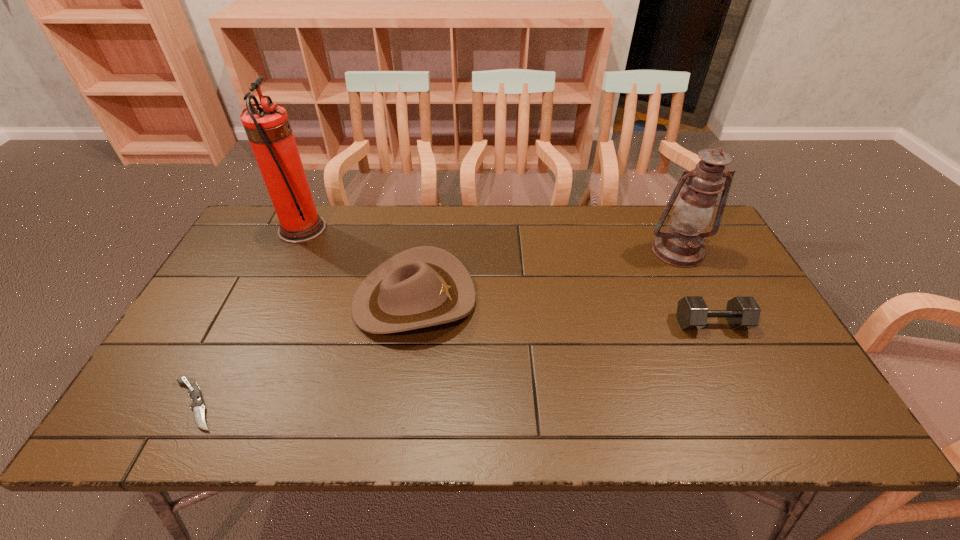
Find the location of a particular element. object that is at the near left corner is located at coordinates (197, 405).

The height and width of the screenshot is (540, 960). In order to click on object located in the far right corner section of the desktop in this screenshot , I will do `click(681, 245)`.

Where is `vacant space at the far edge of the desktop`? vacant space at the far edge of the desktop is located at coordinates (605, 233).

Where is `vacant region at the near edge of the desktop`? vacant region at the near edge of the desktop is located at coordinates (362, 420).

In the image, there is a desktop. What are the coordinates of `free space at the left edge` in the screenshot? It's located at click(x=215, y=391).

Locate an element on the screen. vacant space at the right edge of the desktop is located at coordinates (738, 357).

Identify the location of vacant space at the far left corner of the desktop. The height and width of the screenshot is (540, 960). (272, 220).

Locate an element on the screen. vacant space at the near left corner of the desktop is located at coordinates (136, 438).

Image resolution: width=960 pixels, height=540 pixels. In the image, there is a desktop. Find the location of `vacant space at the far right corner`. vacant space at the far right corner is located at coordinates (658, 215).

At what (x,y) coordinates should I click in order to perform the action: click on free space at the near right corner of the desktop. Please return your answer as a coordinate pair (x, y). The height and width of the screenshot is (540, 960). Looking at the image, I should click on (764, 422).